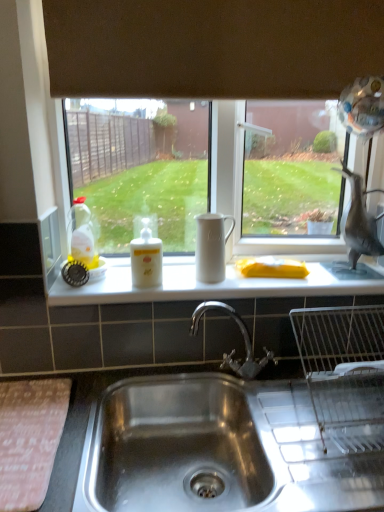
Question: Is white matte jug at center not near translucent yellow liquid at bottle left, arranged as the second bottle when viewed from the right?

Choices:
 (A) no
 (B) yes

Answer: (A)

Question: Is white matte jug at center outside of translucent yellow liquid at bottle left, the 1th bottle viewed from the left?

Choices:
 (A) yes
 (B) no

Answer: (A)

Question: Is the depth of white matte jug at center greater than that of translucent yellow liquid at bottle left, the 1th bottle viewed from the left?

Choices:
 (A) no
 (B) yes

Answer: (A)

Question: Does white matte jug at center appear on the left side of translucent yellow liquid at bottle left, arranged as the second bottle when viewed from the right?

Choices:
 (A) no
 (B) yes

Answer: (A)

Question: From a real-world perspective, is white matte jug at center over translucent yellow liquid at bottle left, the 1th bottle viewed from the left?

Choices:
 (A) no
 (B) yes

Answer: (A)

Question: Considering the relative sizes of white matte jug at center and translucent yellow liquid at bottle left, the 1th bottle viewed from the left, in the image provided, is white matte jug at center shorter than translucent yellow liquid at bottle left, the 1th bottle viewed from the left,?

Choices:
 (A) yes
 (B) no

Answer: (A)

Question: Does white matte bottle at center, which is counted as the 2th bottle, starting from the left, lie behind gray matte bird at right?

Choices:
 (A) yes
 (B) no

Answer: (B)

Question: From the image's perspective, is white matte bottle at center, which is counted as the 2th bottle, starting from the left, located above gray matte bird at right?

Choices:
 (A) yes
 (B) no

Answer: (B)

Question: Would you consider white matte bottle at center, which is counted as the 2th bottle, starting from the left, to be distant from gray matte bird at right?

Choices:
 (A) no
 (B) yes

Answer: (A)

Question: Considering the relative sizes of white matte bottle at center, which is counted as the 2th bottle, starting from the left, and gray matte bird at right in the image provided, is white matte bottle at center, which is counted as the 2th bottle, starting from the left, bigger than gray matte bird at right?

Choices:
 (A) yes
 (B) no

Answer: (B)

Question: From a real-world perspective, does white matte bottle at center, the 1th bottle in the right-to-left sequence, sit lower than gray matte bird at right?

Choices:
 (A) yes
 (B) no

Answer: (A)

Question: Does white matte bottle at center, which is counted as the 2th bottle, starting from the left, lie in front of gray matte bird at right?

Choices:
 (A) no
 (B) yes

Answer: (B)

Question: Can you confirm if stainless steel sink at lower center is positioned to the right of white matte counter top at center?

Choices:
 (A) yes
 (B) no

Answer: (A)